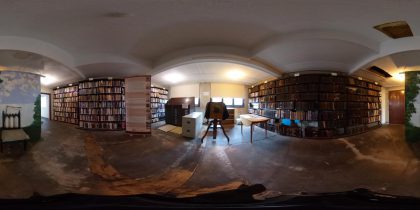
The width and height of the screenshot is (420, 210). In order to click on left wall in this screenshot , I will do `click(21, 88)`.